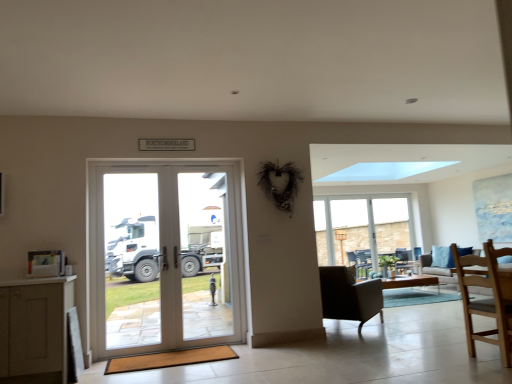
Question: Is clear glass door at center taller or shorter than clear glass window at center?

Choices:
 (A) short
 (B) tall

Answer: (B)

Question: From a real-world perspective, is clear glass door at center physically located above or below clear glass window at center?

Choices:
 (A) below
 (B) above

Answer: (B)

Question: Estimate the real-world distances between objects in this image. Which object is closer to the clear glass door at center?

Choices:
 (A) green matte vase at center
 (B) clear glass window at center
 (C) light brown wooden chair at lower right, which is the 1th chair in front-to-back order
 (D) dark brown leather armchair at lower right, the first chair viewed from the back
 (E) light gray fabric couch at right

Answer: (D)

Question: Based on their relative distances, which object is farther from the white glass door at center?

Choices:
 (A) light brown wooden chair at lower right, which is the 1th chair in front-to-back order
 (B) blue fabric pillow at right
 (C) light gray fabric couch at right
 (D) dark brown leather armchair at right
 (E) green matte vase at center

Answer: (D)